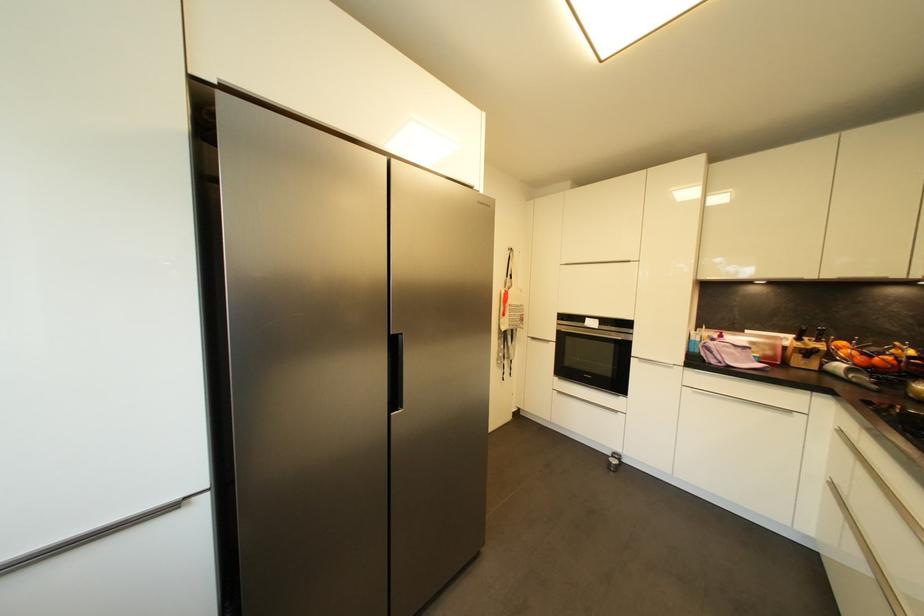
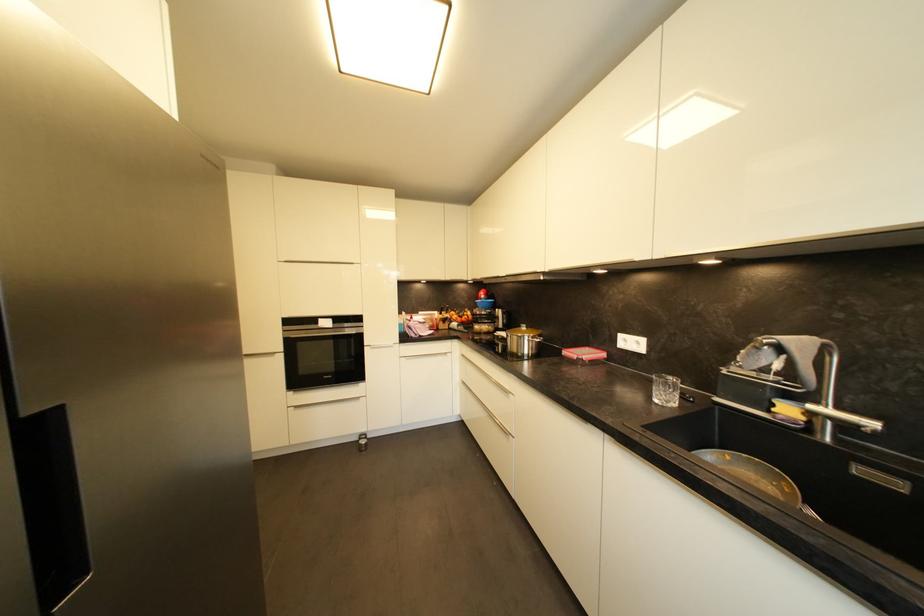
Find the pixel in the second image that matches pixel 407 336 in the first image.

(65, 408)